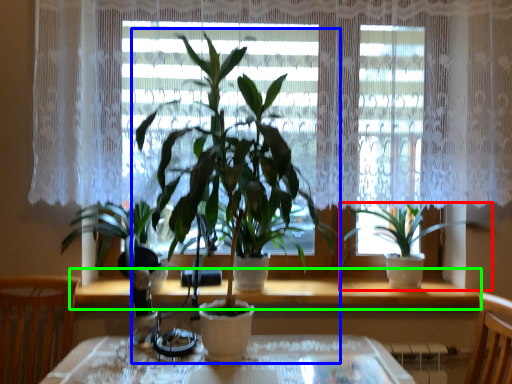
Question: Which is farther away from houseplant (highlighted by a red box)? houseplant (highlighted by a blue box) or window sill (highlighted by a green box)?

Choices:
 (A) houseplant
 (B) window sill

Answer: (A)